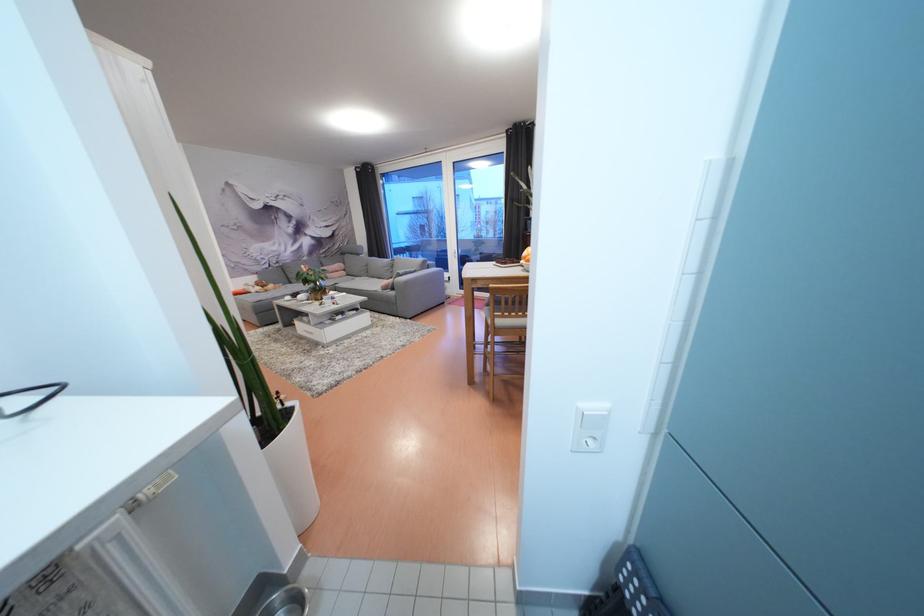
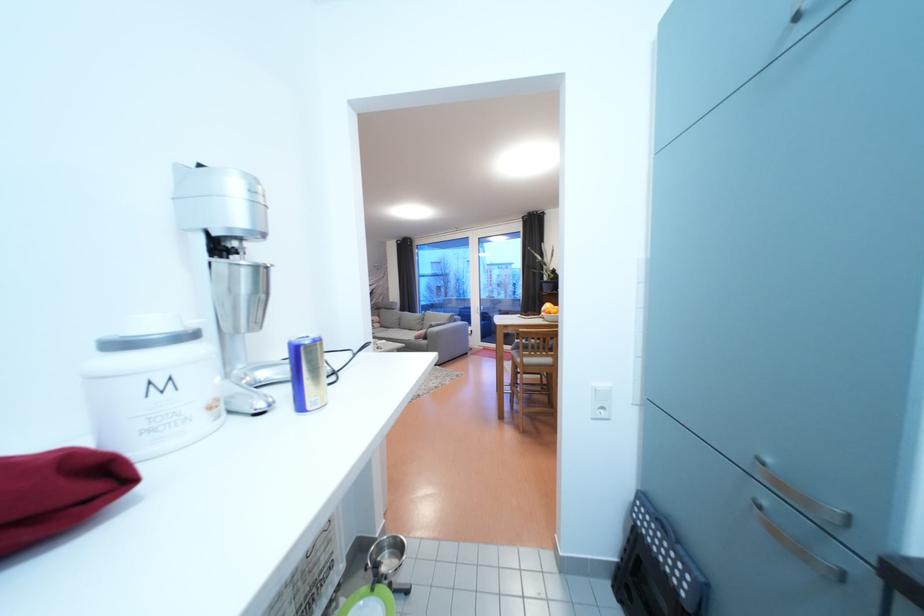
In the second image, find the point that corresponds to pixel 496 326 in the first image.

(526, 365)